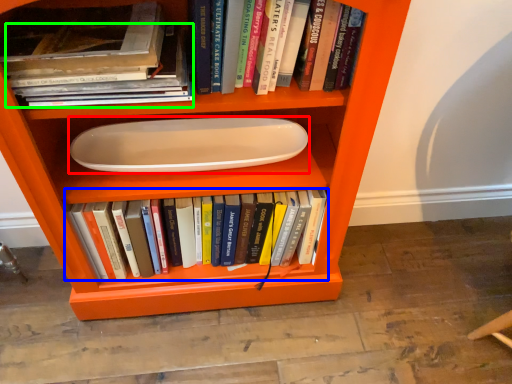
Question: Which object is the farthest from paper plate (highlighted by a red box)? Choose among these: book (highlighted by a blue box) or book (highlighted by a green box).

Choices:
 (A) book
 (B) book

Answer: (B)